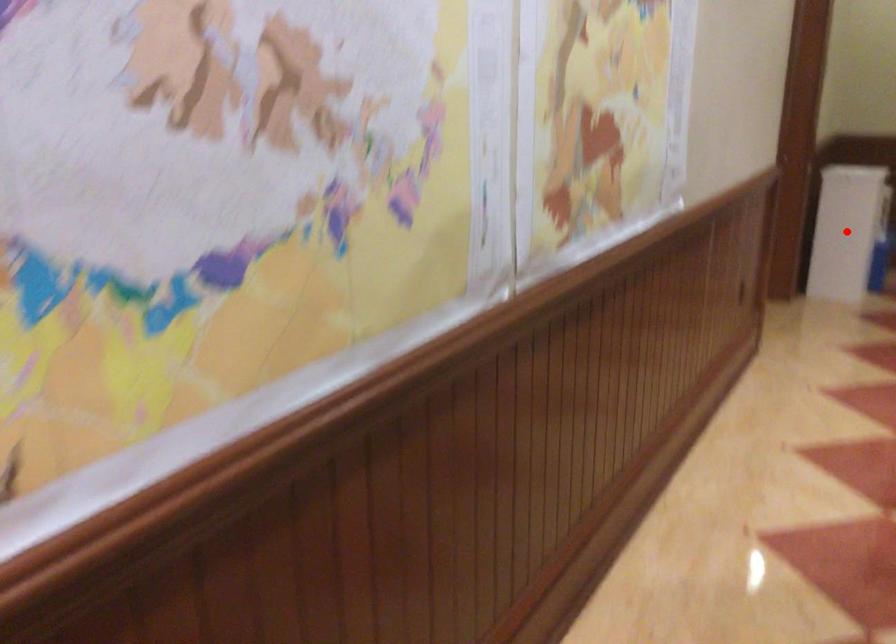
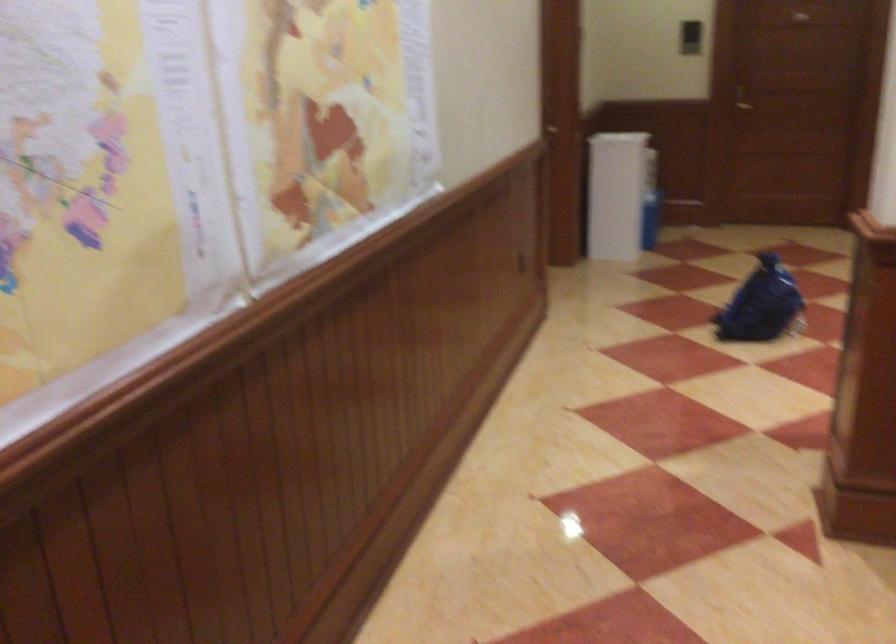
Question: A red point is marked in image1. In image2, is the corresponding 3D point closer to the camera or farther? Reply with the corresponding letter.

Choices:
 (A) The corresponding 3D point is closer.
 (B) The corresponding 3D point is farther.

Answer: (B)